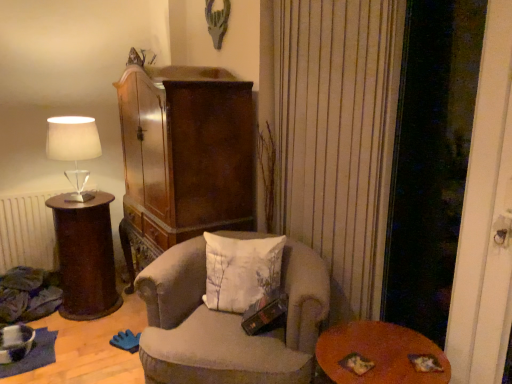
Question: Is point (94, 210) positioned closer to the camera than point (233, 306)?

Choices:
 (A) closer
 (B) farther

Answer: (B)

Question: In terms of width, does brown wood side table at left look wider or thinner when compared to white cotton pillow at center?

Choices:
 (A) wide
 (B) thin

Answer: (A)

Question: Which of these objects is positioned closest to the transparent glass screen door at right?

Choices:
 (A) velvet beige armchair at center
 (B) white fabric lampshade at left
 (C) brown wood side table at left
 (D) white cotton pillow at center
 (E) wooden round table at lower right

Answer: (E)

Question: Estimate the real-world distances between objects in this image. Which object is farther from the velvet beige armchair at center?

Choices:
 (A) brown wood side table at left
 (B) wooden round table at lower right
 (C) transparent glass screen door at right
 (D) white fabric lampshade at left
 (E) white cotton pillow at center

Answer: (D)